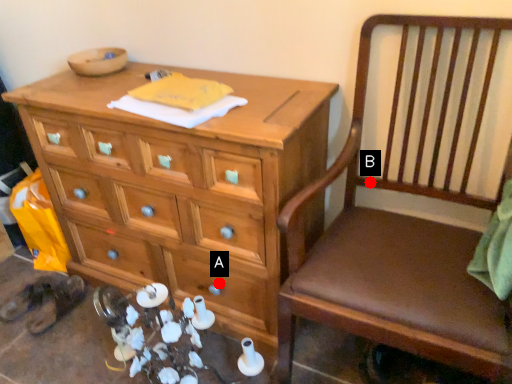
Question: Two points are circled on the image, labeled by A and B beside each circle. Which point is farther from the camera taking this photo?

Choices:
 (A) A is further
 (B) B is further

Answer: (A)